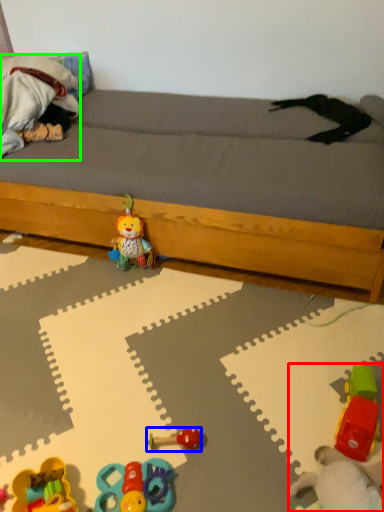
Question: Which object is the farthest from toy (highlighted by a red box)? Choose among these: toy (highlighted by a blue box) or animal (highlighted by a green box).

Choices:
 (A) toy
 (B) animal

Answer: (B)